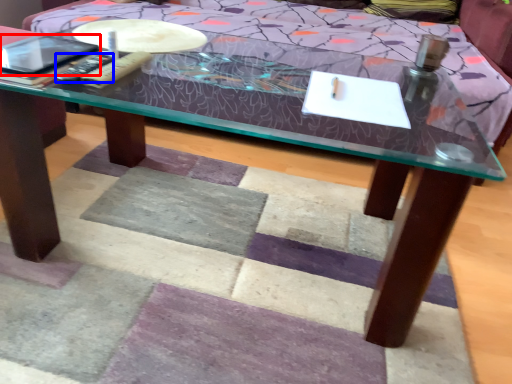
Question: Among these objects, which one is farthest to the camera, tablet computer (highlighted by a red box) or remote (highlighted by a blue box)?

Choices:
 (A) tablet computer
 (B) remote

Answer: (B)